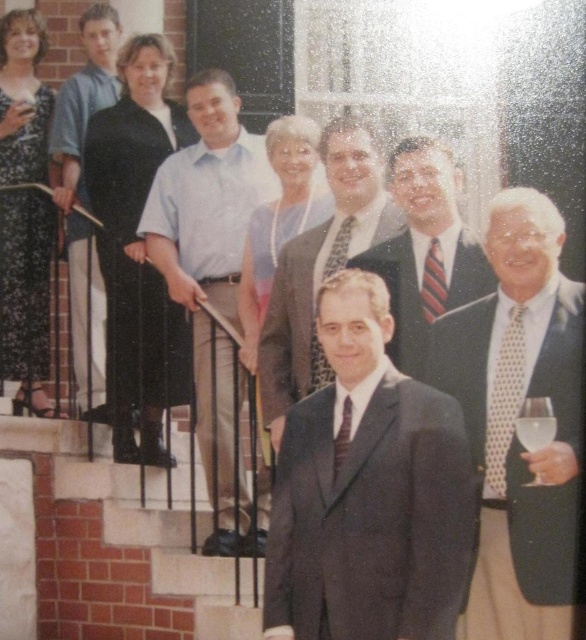
Does white dotted tie at right have a greater width compared to light blue shirt at center?

Indeed, white dotted tie at right has a greater width compared to light blue shirt at center.

Between point (492, 371) and point (209, 170), which one is positioned in front?

Positioned in front is point (492, 371).

Where is `white dotted tie at right`? white dotted tie at right is located at coordinates (516, 419).

Is dark gray suit at center below white dotted tie at right?

Yes, dark gray suit at center is below white dotted tie at right.

You are a GUI agent. You are given a task and a screenshot of the screen. Output one action in this format:
    pyautogui.click(x=<x>, y=<y>)
    Task: Click on the dark gray suit at center
    
    Given the screenshot: What is the action you would take?
    pyautogui.click(x=367, y=490)

Between point (359, 348) and point (475, 632), which one is positioned behind?

Point (359, 348)

The image size is (586, 640). I want to click on dark gray suit at center, so click(x=367, y=490).

Does dark gray suit at center appear under shiny dark suit at center?

Yes, dark gray suit at center is below shiny dark suit at center.

Between dark gray suit at center and shiny dark suit at center, which one has less height?

Standing shorter between the two is shiny dark suit at center.

Is point (294, 596) positioned after point (486, 276)?

No, (294, 596) is closer to viewer.

Where is `dark gray suit at center`? dark gray suit at center is located at coordinates (367, 490).